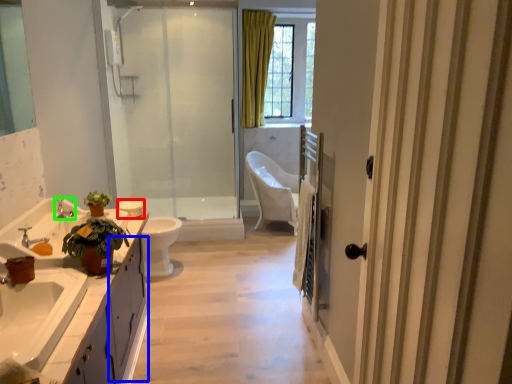
Question: Estimate the real-world distances between objects in this image. Which object is farther from toilet bowl (highlighted by a red box), cabinetry (highlighted by a blue box) or tap (highlighted by a green box)?

Choices:
 (A) cabinetry
 (B) tap

Answer: (A)